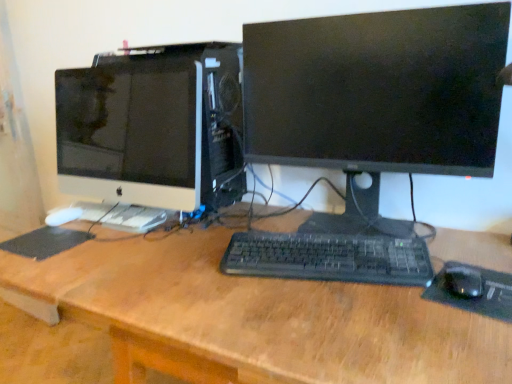
Identify the location of vacant space to the left of black plastic keyboard at center. (188, 270).